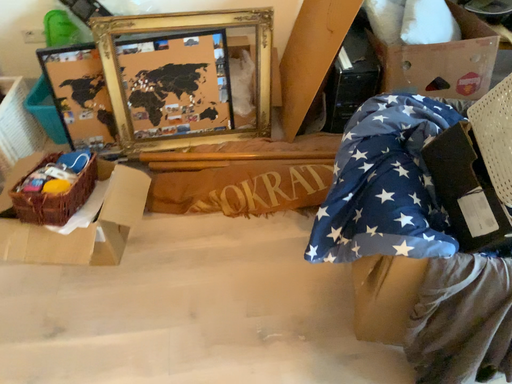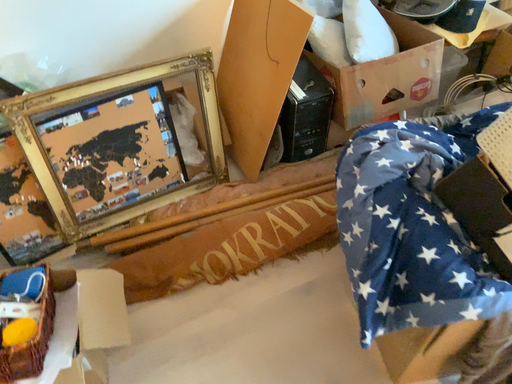
Question: Which way did the camera rotate in the video?

Choices:
 (A) rotated right
 (B) rotated left

Answer: (A)